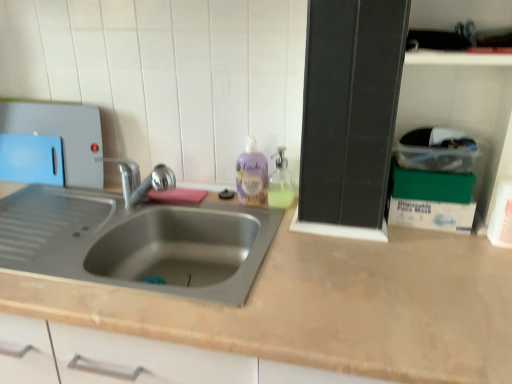
Question: Is clear plastic container at upper right, which is the 1th box from top to bottom, situated inside green cardboard box at upper right, which is the 2th box in top-to-bottom order, or outside?

Choices:
 (A) inside
 (B) outside

Answer: (B)

Question: From the image's perspective, is clear plastic container at upper right, which is the 1th box from top to bottom, positioned above or below green cardboard box at upper right, which is the 2th box in bottom-to-top order?

Choices:
 (A) above
 (B) below

Answer: (A)

Question: Which object is the farthest from the green cardboard box at right, which appears as the third box when viewed from the top?

Choices:
 (A) pink sponge at sink
 (B) translucent plastic soap dispenser at upper right
 (C) green cardboard box at upper right, which is the 2th box in bottom-to-top order
 (D) clear plastic container at upper right, which appears as the third box when ordered from the bottom
 (E) purple translucent liquid soap at center

Answer: (A)

Question: Estimate the real-world distances between objects in this image. Which object is farther from the green cardboard box at upper right, which is the 2th box in top-to-bottom order?

Choices:
 (A) green cardboard box at right, which appears as the 1th box when ordered from the bottom
 (B) purple translucent liquid soap at center
 (C) blue plastic cutting board at left
 (D) pink sponge at sink
 (E) clear plastic container at upper right, which appears as the third box when ordered from the bottom

Answer: (C)